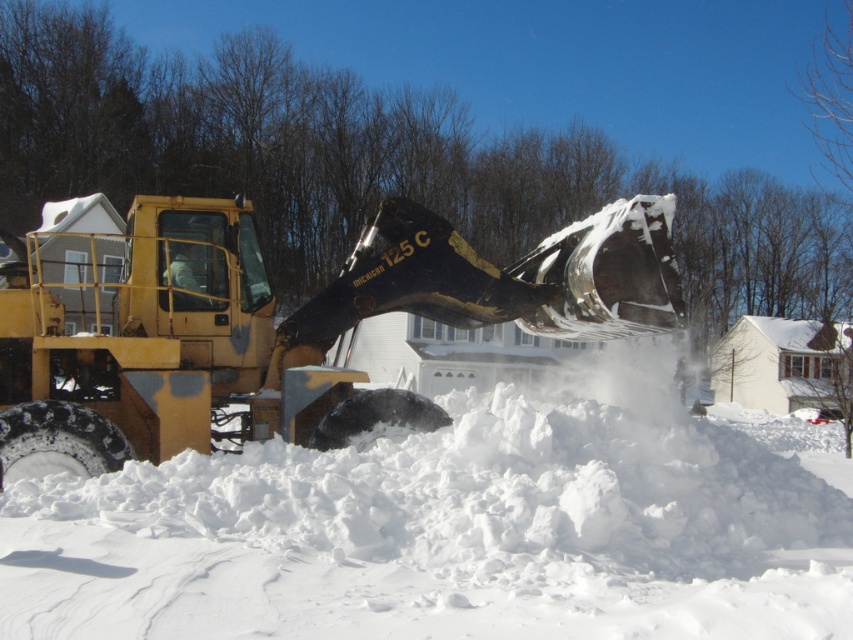
Question: Does white fluffy snow at center appear on the left side of yellow metallic tractor at left?

Choices:
 (A) no
 (B) yes

Answer: (A)

Question: Does white fluffy snow at center appear over yellow metallic tractor at left?

Choices:
 (A) yes
 (B) no

Answer: (B)

Question: Is white fluffy snow at center wider than yellow metallic tractor at left?

Choices:
 (A) no
 (B) yes

Answer: (B)